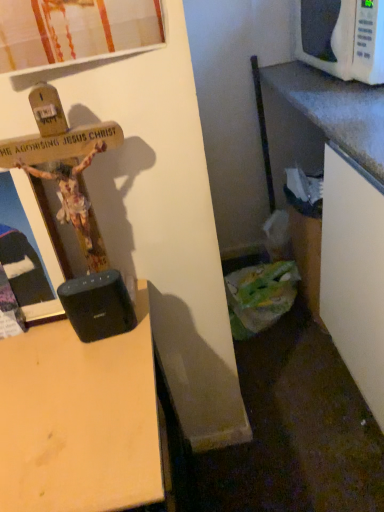
At what (x,y) coordinates should I click in order to perform the action: click on blank space situated above wooden desk at center (from a real-world perspective). Please return your answer as a coordinate pair (x, y). This screenshot has height=512, width=384. Looking at the image, I should click on (50, 387).